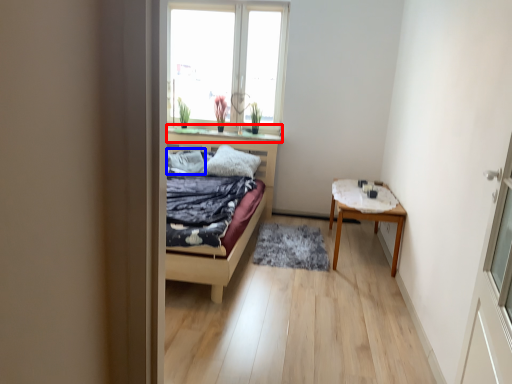
Question: Which of the following is the farthest to the observer, window sill (highlighted by a red box) or pillow (highlighted by a blue box)?

Choices:
 (A) window sill
 (B) pillow

Answer: (A)